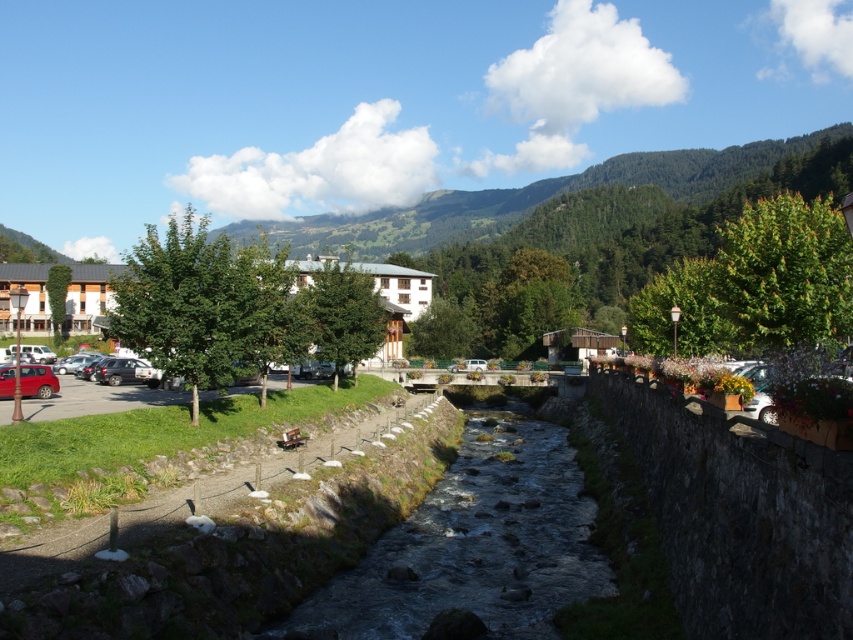
Can you confirm if clear water at center is positioned below wooden hotel at left?

Yes, clear water at center is below wooden hotel at left.

Does point (486, 525) lie behind point (120, 273)?

No, (486, 525) is closer to viewer.

This screenshot has width=853, height=640. What do you see at coordinates (474, 544) in the screenshot? I see `clear water at center` at bounding box center [474, 544].

This screenshot has height=640, width=853. I want to click on clear water at center, so click(x=474, y=544).

Between point (1, 301) and point (42, 394), which one is positioned behind?

The point (1, 301) is behind.

Does wooden hotel at left lie in front of matte red car at lower left?

Yes, it is.

Where is `wooden hotel at left`? wooden hotel at left is located at coordinates (88, 296).

Identify the location of wooden hotel at left. This screenshot has height=640, width=853. (88, 296).

Can you confirm if clear water at center is taller than matte red car at lower left?

Indeed, clear water at center has a greater height compared to matte red car at lower left.

Can you confirm if clear water at center is smaller than matte red car at lower left?

Actually, clear water at center might be larger than matte red car at lower left.

Which is in front, point (537, 438) or point (33, 380)?

Point (33, 380) is more forward.

This screenshot has width=853, height=640. I want to click on clear water at center, so click(474, 544).